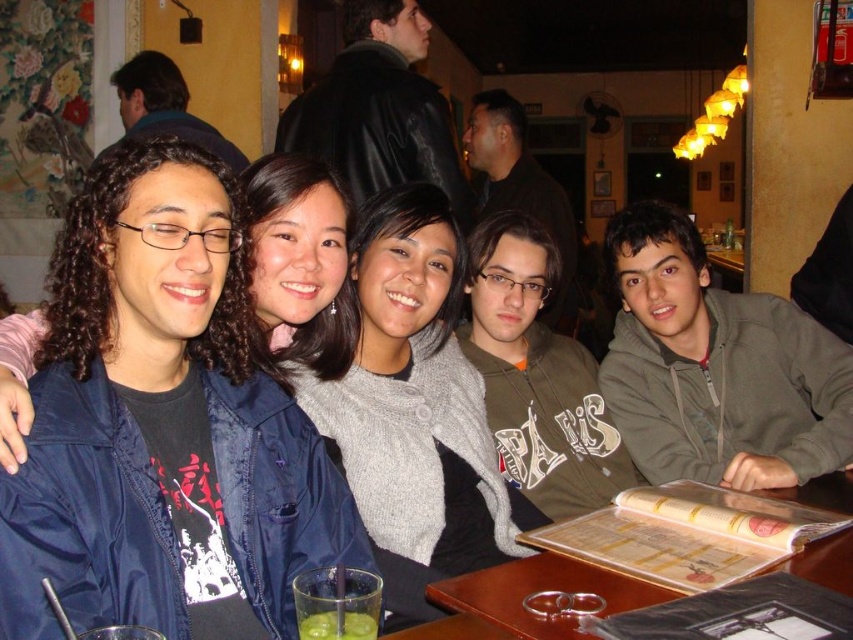
You are a photographer trying to capture a group photo of the matte gray sweater at center and the green matte glass at lower center. Which object should you focus on first to ensure both are in frame?

The matte gray sweater at center is much taller than the green matte glass at lower center, so you should focus on the matte gray sweater at center first to ensure both are in frame.

You are a photographer standing in front of the group of five people at the restaurant. You want to take a photo that includes both the point at coordinates point (74, 273) and point (360, 637). Which point is closer to you so you can adjust your focus accordingly?

Point (74, 273) is closer to you than point (360, 637), so you should focus on that point first to ensure clarity in the photograph.

You are a photographer trying to capture a group photo of the matte gray sweater at center and the gray fleece hoodie at right. Since you want both subjects to be clearly visible in the frame, which one should you focus on first to ensure proper depth of field?

The matte gray sweater at center should be focused on first because it is positioned under the gray fleece hoodie at right, meaning it is closer to the camera. By focusing on the closer subject, the depth of field will naturally include the farther subject in the background.